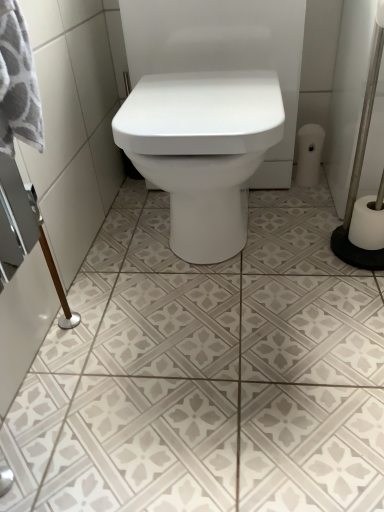
The width and height of the screenshot is (384, 512). What are the coordinates of `free space on the front side of white matte toilet paper at right, which is the 1th toilet paper from front to back` in the screenshot? It's located at (359, 281).